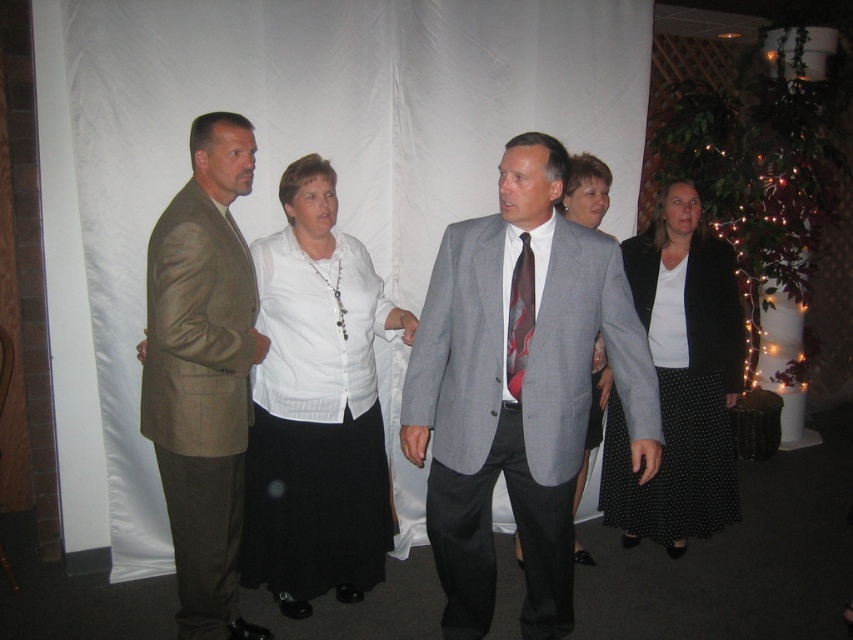
Question: Which point is closer to the camera?

Choices:
 (A) [595, 419]
 (B) [227, 144]
 (C) [511, 316]

Answer: (C)

Question: Which of the following is the closest to the observer?

Choices:
 (A) gray textured suit at center
 (B) khaki fabric suit at left

Answer: (A)

Question: Is black dotted skirt at center in front of white textured blouse at center?

Choices:
 (A) yes
 (B) no

Answer: (B)

Question: Is khaki fabric suit at left below black dotted skirt at center?

Choices:
 (A) no
 (B) yes

Answer: (B)

Question: Does white fabric at center have a greater width compared to white textured blouse at center?

Choices:
 (A) yes
 (B) no

Answer: (A)

Question: Among these objects, which one is farthest from the camera?

Choices:
 (A) white fabric at center
 (B) white matte shirt at center
 (C) khaki fabric suit at left

Answer: (A)